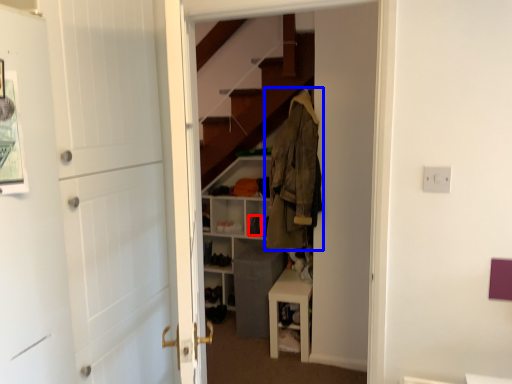
Question: Which of the following is the closest to the observer, shoe (highlighted by a red box) or clothing (highlighted by a blue box)?

Choices:
 (A) shoe
 (B) clothing

Answer: (B)